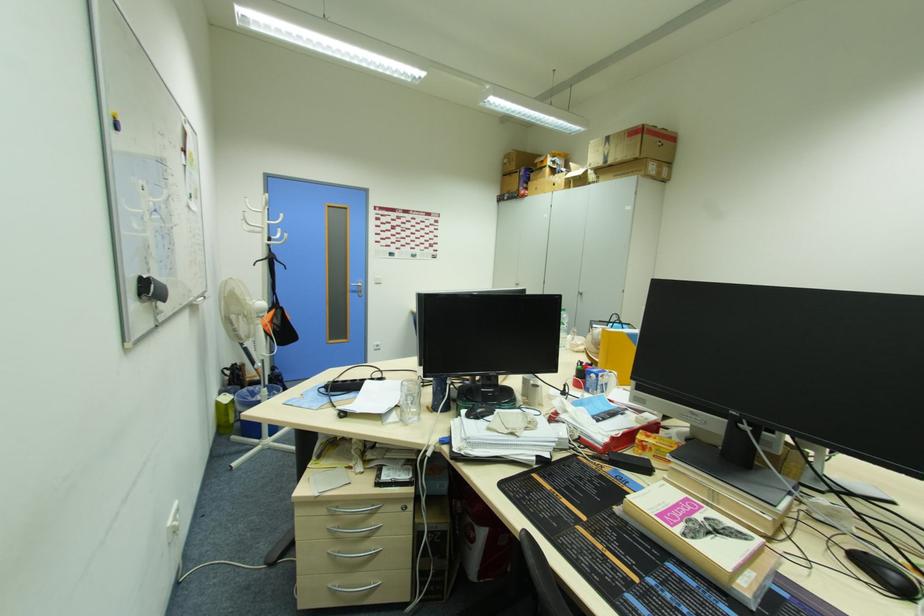
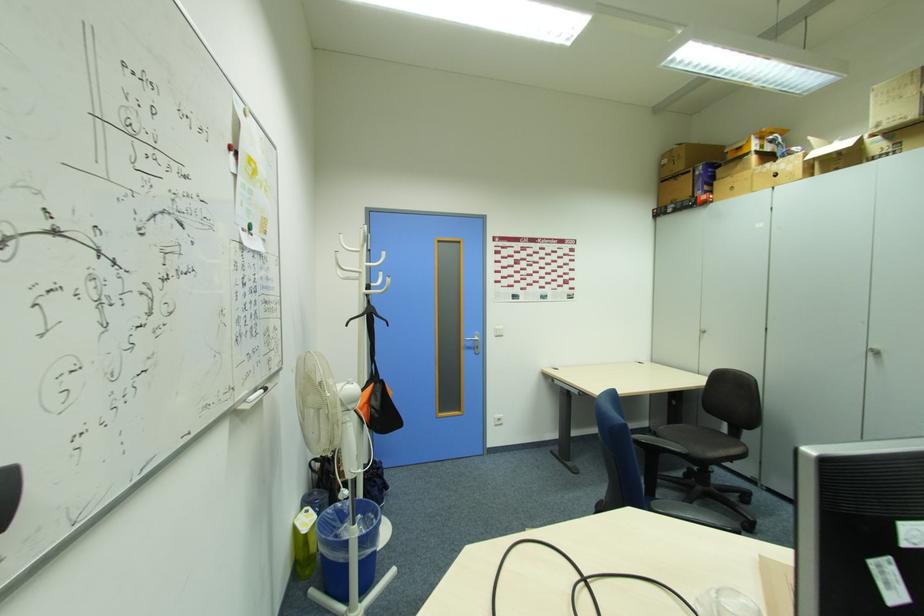
The point at (x=529, y=193) is marked in the first image. Where is the corresponding point in the second image?

(714, 198)